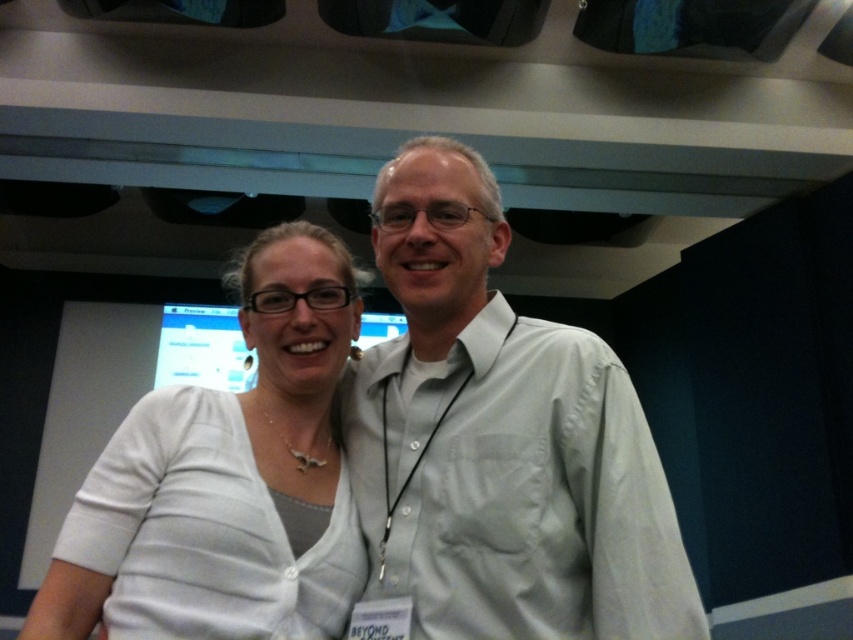
Is light gray shirt at center smaller than white matte shirt at center?

No, light gray shirt at center is not smaller than white matte shirt at center.

Is light gray shirt at center positioned behind white matte shirt at center?

No, it is not.

Which is behind, point (637, 452) or point (141, 570)?

The point (141, 570) is behind.

The width and height of the screenshot is (853, 640). I want to click on light gray shirt at center, so click(500, 440).